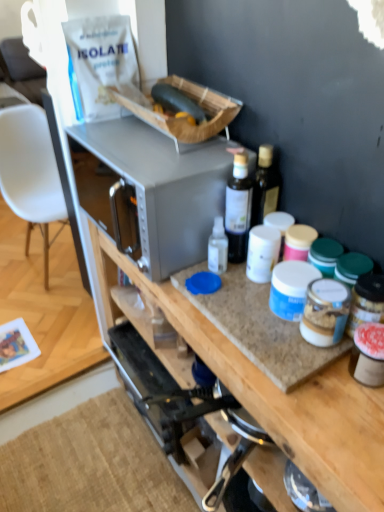
Locate an element on the screen. This screenshot has height=512, width=384. vacant area that lies in front of green matte zucchini at upper center is located at coordinates (173, 150).